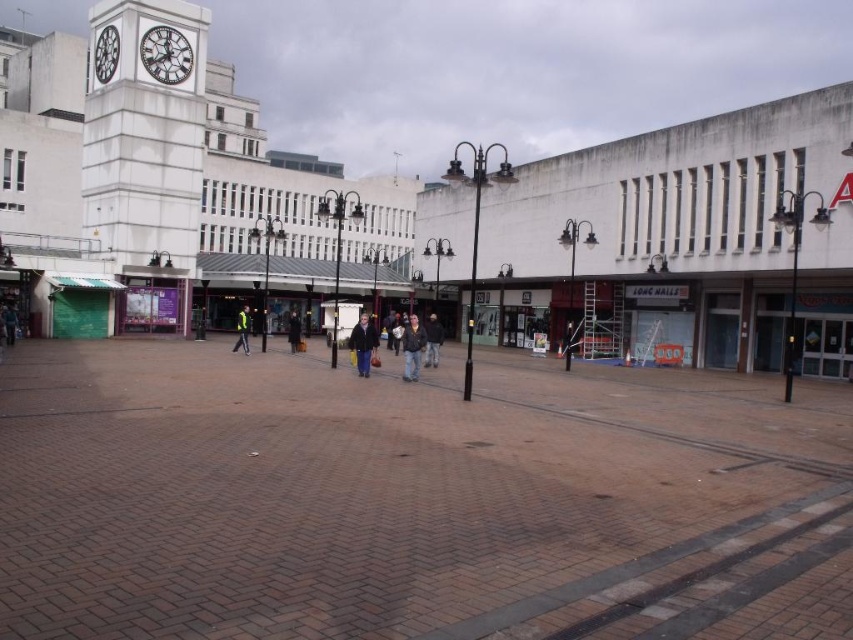
Does reflective yellow jacket at center appear on the left side of dark brown leather coat at center?

Indeed, reflective yellow jacket at center is positioned on the left side of dark brown leather coat at center.

Does point (248, 332) lie behind point (292, 317)?

That is False.

The height and width of the screenshot is (640, 853). I want to click on reflective yellow jacket at center, so click(x=242, y=330).

Is point (744, 454) positioned before point (293, 314)?

That is True.

Does brick pavement at center appear under dark brown leather coat at center?

Yes.

What do you see at coordinates (413, 499) in the screenshot? The image size is (853, 640). I see `brick pavement at center` at bounding box center [413, 499].

You are a GUI agent. You are given a task and a screenshot of the screen. Output one action in this format:
    pyautogui.click(x=<x>, y=<y>)
    Task: Click on the brick pavement at center
    The height and width of the screenshot is (640, 853).
    Given the screenshot: What is the action you would take?
    pyautogui.click(x=413, y=499)

Does white stone clock tower at upper left have a larger size compared to dark brown leather jacket at center?

Correct, white stone clock tower at upper left is larger in size than dark brown leather jacket at center.

Does white stone clock tower at upper left have a greater width compared to dark brown leather jacket at center?

Correct, the width of white stone clock tower at upper left exceeds that of dark brown leather jacket at center.

What are the coordinates of `white stone clock tower at upper left` in the screenshot? It's located at (148, 141).